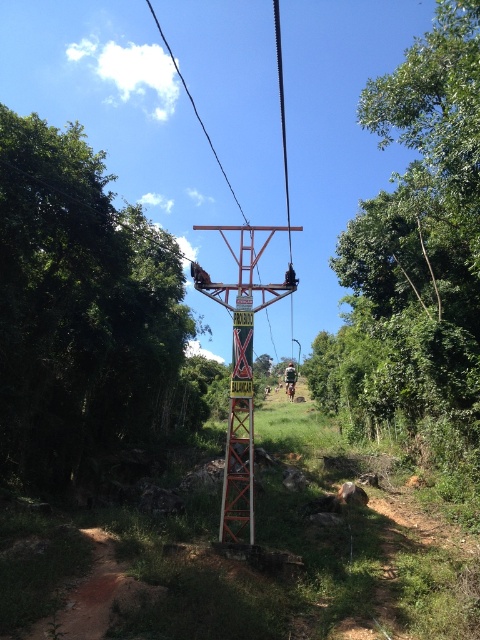
Question: Among these points, which one is nearest to the camera?

Choices:
 (A) (288, 394)
 (B) (418, 323)
 (C) (280, 109)

Answer: (B)

Question: Which point is closer to the camera taking this photo?

Choices:
 (A) (291, 376)
 (B) (285, 276)
 (C) (49, 276)

Answer: (B)

Question: Can you confirm if metallic wire at center is thinner than brown leather backpack at center?

Choices:
 (A) no
 (B) yes

Answer: (A)

Question: Among these objects, which one is farthest from the camera?

Choices:
 (A) metallic wire at center
 (B) green leafy tree at center

Answer: (A)

Question: Considering the relative positions of rustic wood sign at center and metallic wire at center in the image provided, where is rustic wood sign at center located with respect to metallic wire at center?

Choices:
 (A) right
 (B) left

Answer: (B)

Question: Does rustic wood sign at center appear on the left side of metallic wire at center?

Choices:
 (A) yes
 (B) no

Answer: (A)